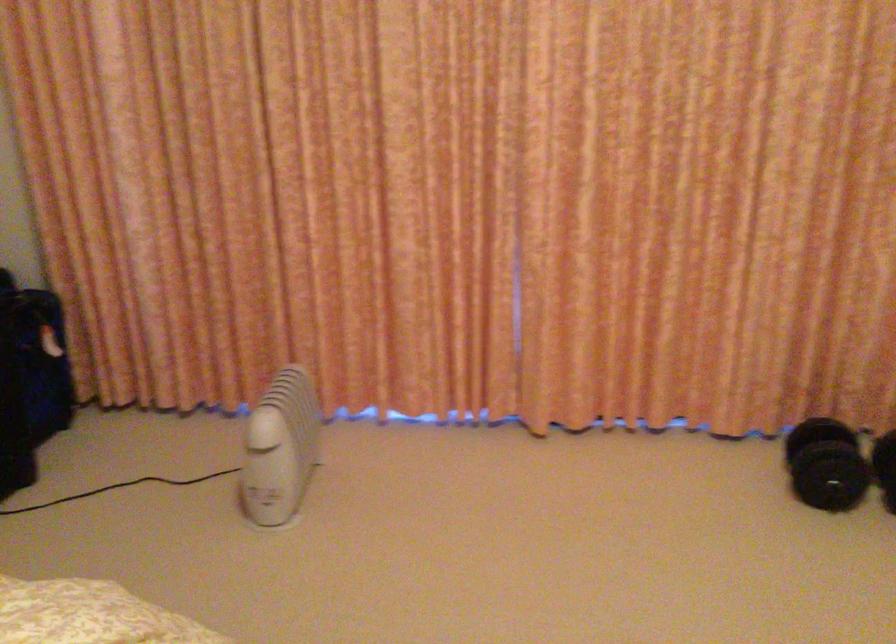
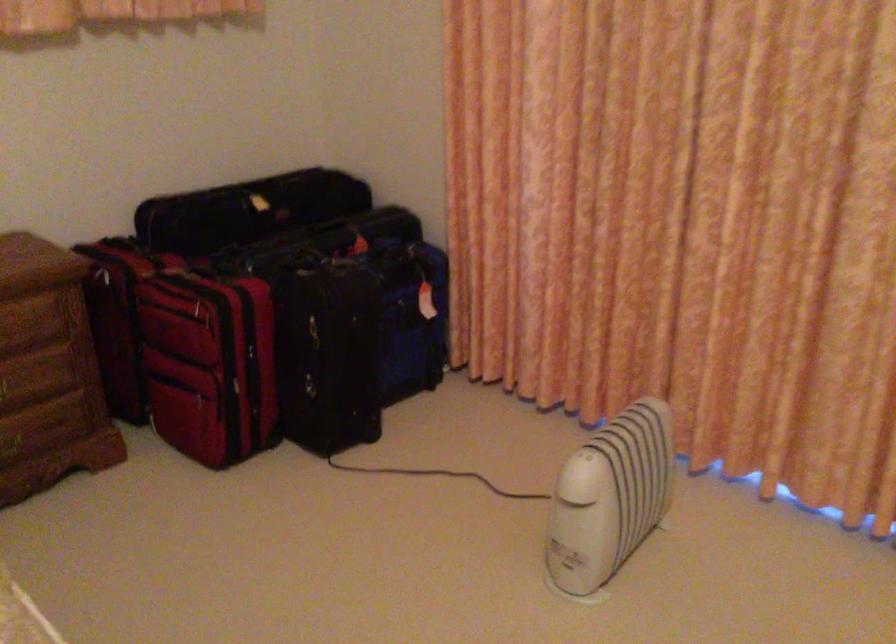
Locate, in the second image, the point that corresponds to point 289,438 in the first image.

(609, 498)